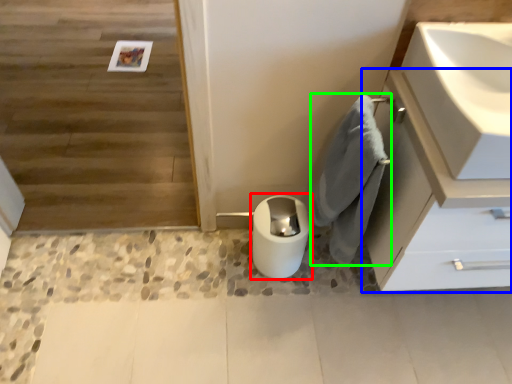
Question: Considering the real-world distances, which object is closest to toilet bowl (highlighted by a red box)? bathroom cabinet (highlighted by a blue box) or bath towel (highlighted by a green box).

Choices:
 (A) bathroom cabinet
 (B) bath towel

Answer: (B)